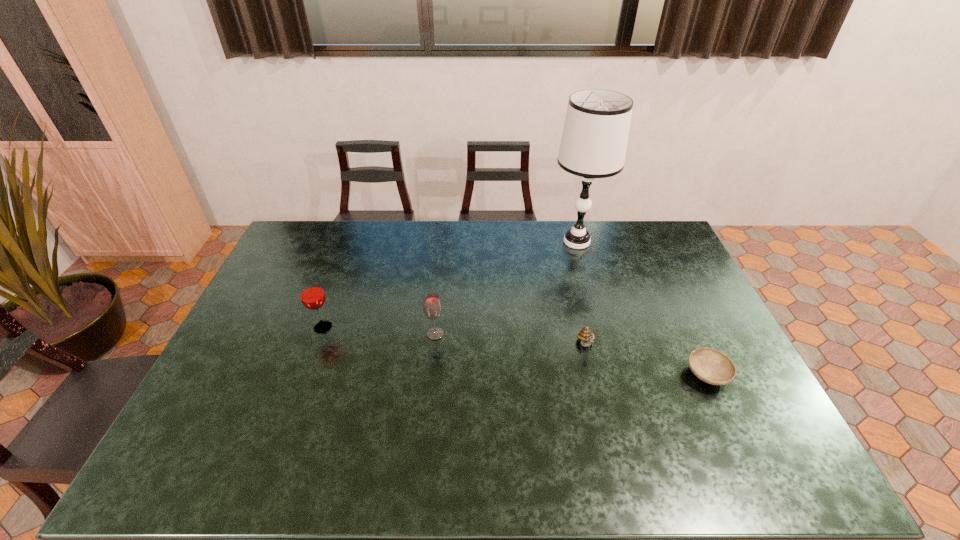
Find the location of a particular element. blank space located 0.130m on the back of the third tallest object is located at coordinates (439, 298).

Identify the location of free location located on the face of the fourth tallest object. (612, 455).

Identify the location of free space located 0.220m on the front of the bowl. (755, 476).

The height and width of the screenshot is (540, 960). In order to click on object positioned at the far edge in this screenshot , I will do `click(594, 141)`.

Where is `object present at the right edge`? The height and width of the screenshot is (540, 960). object present at the right edge is located at coordinates (711, 366).

Where is `vacant space at the far edge of the desktop`? The image size is (960, 540). vacant space at the far edge of the desktop is located at coordinates (559, 246).

Locate an element on the screen. Image resolution: width=960 pixels, height=540 pixels. vacant space at the left edge of the desktop is located at coordinates (283, 299).

Where is `free point at the far left corner`? free point at the far left corner is located at coordinates (330, 227).

Locate an element on the screen. unoccupied area between the left glass drink container and the snail is located at coordinates (454, 336).

Image resolution: width=960 pixels, height=540 pixels. Find the location of `free space between the second shortest object and the shortest object`. free space between the second shortest object and the shortest object is located at coordinates (646, 360).